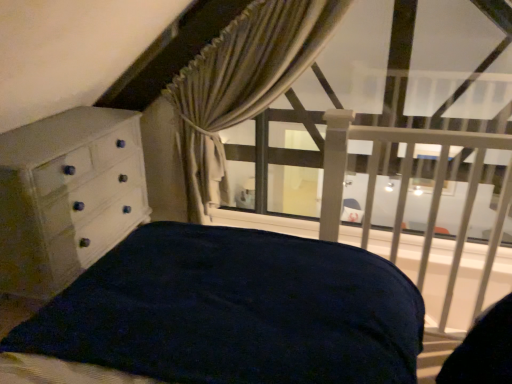
The width and height of the screenshot is (512, 384). Identify the location of vacant space situated above white painted wood chest of drawers at left (from a real-world perspective). (54, 134).